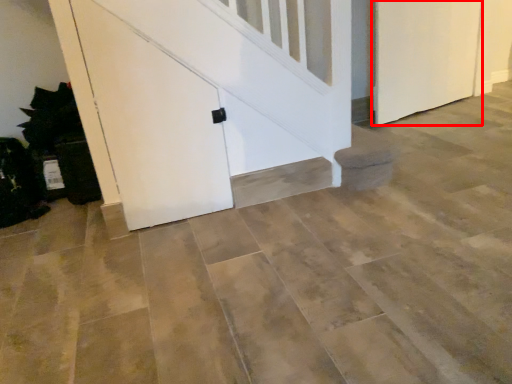
Question: From the image's perspective, where is door (annotated by the red box) located in relation to door in the image?

Choices:
 (A) below
 (B) above

Answer: (B)